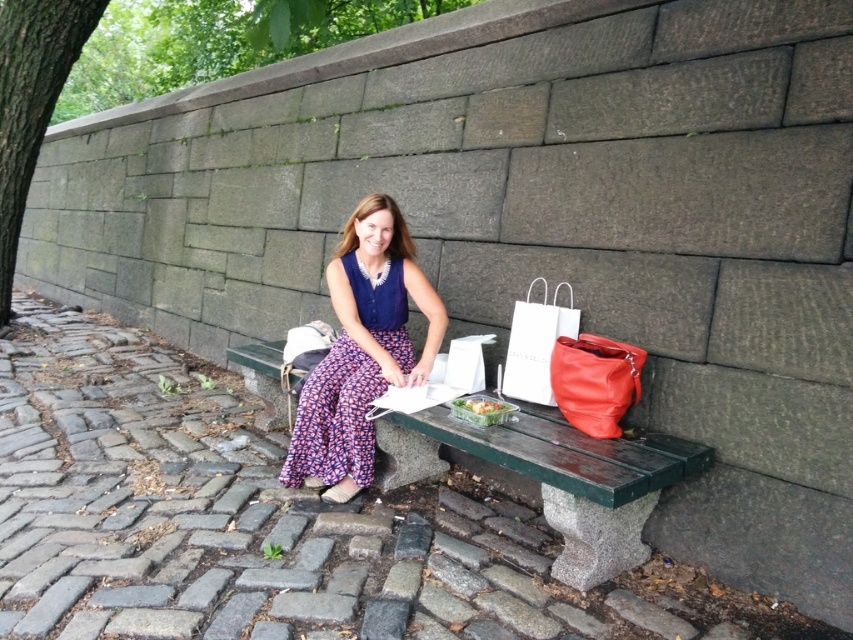
Who is higher up, green polished wood bench at center or blue fabric dress at center?

blue fabric dress at center is higher up.

Which is more to the right, green polished wood bench at center or blue fabric dress at center?

green polished wood bench at center is more to the right.

Does point (579, 529) come in front of point (341, 372)?

Yes, it is in front of point (341, 372).

Identify the location of green polished wood bench at center. (554, 477).

Is green polished wood bench at center below white paper bag at right?

Indeed, green polished wood bench at center is positioned under white paper bag at right.

Is green polished wood bench at center closer to camera compared to white paper bag at right?

That is True.

You are a GUI agent. You are given a task and a screenshot of the screen. Output one action in this format:
    pyautogui.click(x=<x>, y=<y>)
    Task: Click on the green polished wood bench at center
    The height and width of the screenshot is (640, 853).
    Given the screenshot: What is the action you would take?
    pyautogui.click(x=554, y=477)

Based on the photo, is green polished wood bench at center to the left of translucent plastic container at center from the viewer's perspective?

In fact, green polished wood bench at center is to the right of translucent plastic container at center.

Does green polished wood bench at center appear on the right side of translucent plastic container at center?

Indeed, green polished wood bench at center is positioned on the right side of translucent plastic container at center.

Is point (650, 458) closer to camera compared to point (474, 413)?

Yes, point (650, 458) is in front of point (474, 413).

What are the coordinates of `green polished wood bench at center` in the screenshot? It's located at (554, 477).